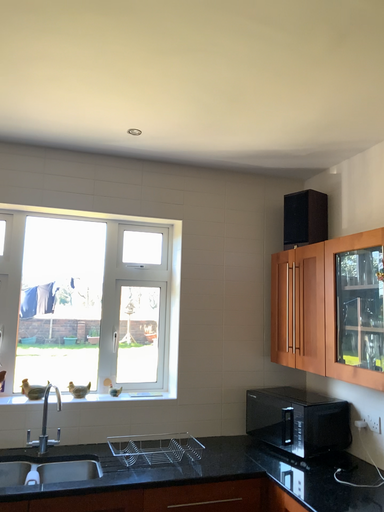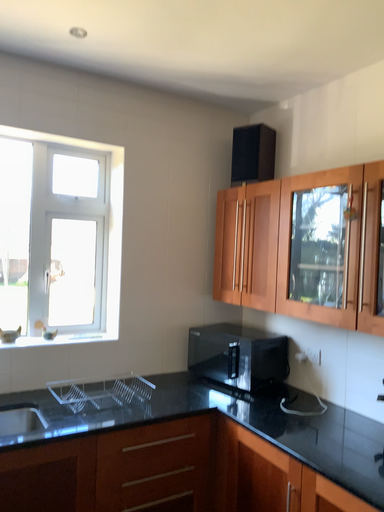
Question: How did the camera likely rotate when shooting the video?

Choices:
 (A) rotated left
 (B) rotated right

Answer: (B)